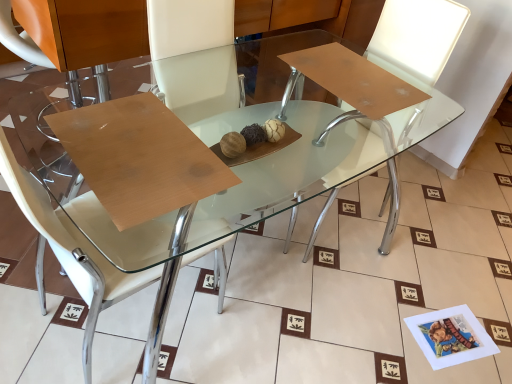
Measure the distance between white leather chair at center, the first chair in the left-to-right sequence, and camera.

They are 25.35 inches apart.

The image size is (512, 384). Identify the location of wooden at center. (139, 157).

Considering the relative positions of white leather chair at center, the first chair in the left-to-right sequence, and white leather chair at center, acting as the 2th chair starting from the left, in the image provided, is white leather chair at center, the first chair in the left-to-right sequence, in front of white leather chair at center, acting as the 2th chair starting from the left,?

Yes.

Which is more to the right, white leather chair at center, which is counted as the second chair, starting from the right, or white leather chair at center, which ranks as the first chair in right-to-left order?

From the viewer's perspective, white leather chair at center, which ranks as the first chair in right-to-left order, appears more on the right side.

Which object is thinner, white leather chair at center, the first chair in the left-to-right sequence, or white leather chair at center, which ranks as the first chair in right-to-left order?

white leather chair at center, the first chair in the left-to-right sequence.

Who is smaller, white leather chair at center, the first chair in the left-to-right sequence, or white leather chair at center, acting as the 2th chair starting from the left?

With smaller size is white leather chair at center, acting as the 2th chair starting from the left.

In order to click on cardboard on the right side of white leather chair at center, the first chair in the left-to-right sequence in this screenshot , I will do `click(139, 157)`.

Could you tell me if wooden at center is turned towards white leather chair at center, the first chair in the left-to-right sequence?

Yes, wooden at center is facing white leather chair at center, the first chair in the left-to-right sequence.

Which of these two, wooden at center or white leather chair at center, which is counted as the second chair, starting from the right, is smaller?

wooden at center.

Can you tell me how much wooden at center and white leather chair at center, the first chair in the left-to-right sequence, differ in facing direction?

The angular difference between wooden at center and white leather chair at center, the first chair in the left-to-right sequence, is 93.3 degrees.

At what (x,y) coordinates should I click in order to perform the action: click on cardboard behind the white leather chair at center, which is counted as the second chair, starting from the right. Please return your answer as a coordinate pair (x, y). Looking at the image, I should click on (139, 157).

Would you consider white leather chair at center, the first chair in the left-to-right sequence, to be distant from wooden at center?

Actually, white leather chair at center, the first chair in the left-to-right sequence, and wooden at center are a little close together.

Could you tell me if white leather chair at center, which is counted as the second chair, starting from the right, is facing wooden at center?

Yes, white leather chair at center, which is counted as the second chair, starting from the right, is facing wooden at center.

Looking at this image, which object is further away from the camera, white leather chair at center, which is counted as the second chair, starting from the right, or wooden at center?

wooden at center is further away from the camera.

Looking at the image, does white leather chair at center, acting as the 2th chair starting from the left, seem bigger or smaller compared to wooden at center?

Clearly, white leather chair at center, acting as the 2th chair starting from the left, is larger in size than wooden at center.

You are a GUI agent. You are given a task and a screenshot of the screen. Output one action in this format:
    pyautogui.click(x=<x>, y=<y>)
    Task: Click on the cardboard that is above the white leather chair at center, which ranks as the first chair in right-to-left order (from a real-world perspective)
    The image size is (512, 384).
    Given the screenshot: What is the action you would take?
    pyautogui.click(x=139, y=157)

Can wooden at center be found inside white leather chair at center, which ranks as the first chair in right-to-left order?

Definitely not — wooden at center is not inside white leather chair at center, which ranks as the first chair in right-to-left order.

Is wooden at center inside the boundaries of white leather chair at center, which ranks as the first chair in right-to-left order, or outside?

wooden at center is not enclosed by white leather chair at center, which ranks as the first chair in right-to-left order.

Locate an element on the screen. Image resolution: width=512 pixels, height=384 pixels. chair above the wooden at center (from the image's perspective) is located at coordinates (398, 96).

What's the angular difference between wooden at center and white leather chair at center, which ranks as the first chair in right-to-left order,'s facing directions?

The angular difference between wooden at center and white leather chair at center, which ranks as the first chair in right-to-left order, is 90 degrees.

Does point (84, 142) appear closer or farther from the camera than point (390, 191)?

Point (84, 142).

Does white leather chair at center, acting as the 2th chair starting from the left, turn towards white leather chair at center, which is counted as the second chair, starting from the right?

No, white leather chair at center, acting as the 2th chair starting from the left, does not turn towards white leather chair at center, which is counted as the second chair, starting from the right.

Find the location of a particular element. This screenshot has width=512, height=384. chair that is behind the white leather chair at center, which is counted as the second chair, starting from the right is located at coordinates (398, 96).

Is point (368, 147) closer or farther from the camera than point (49, 207)?

Point (368, 147) is farther from the camera than point (49, 207).

Image resolution: width=512 pixels, height=384 pixels. What are the coordinates of `chair below the white leather chair at center, which is counted as the second chair, starting from the right (from a real-world perspective)` in the screenshot? It's located at (398, 96).

Where is `chair that is below the wooden at center (from the image's perspective)`? chair that is below the wooden at center (from the image's perspective) is located at coordinates (72, 249).

Estimate the real-world distances between objects in this image. Which object is further from white leather chair at center, which is counted as the second chair, starting from the right, wooden at center or white leather chair at center, which ranks as the first chair in right-to-left order?

white leather chair at center, which ranks as the first chair in right-to-left order, is positioned further to the anchor white leather chair at center, which is counted as the second chair, starting from the right.

Estimate the real-world distances between objects in this image. Which object is closer to white leather chair at center, which ranks as the first chair in right-to-left order, white leather chair at center, which is counted as the second chair, starting from the right, or wooden at center?

Based on the image, wooden at center appears to be nearer to white leather chair at center, which ranks as the first chair in right-to-left order.

When comparing their distances from wooden at center, does white leather chair at center, acting as the 2th chair starting from the left, or white leather chair at center, the first chair in the left-to-right sequence, seem further?

The object further to wooden at center is white leather chair at center, acting as the 2th chair starting from the left.

Consider the image. Looking at the image, which one is located further to wooden at center, white leather chair at center, the first chair in the left-to-right sequence, or white leather chair at center, which ranks as the first chair in right-to-left order?

The object further to wooden at center is white leather chair at center, which ranks as the first chair in right-to-left order.

From the image, which object appears to be nearer to white leather chair at center, the first chair in the left-to-right sequence, white leather chair at center, which ranks as the first chair in right-to-left order, or wooden at center?

wooden at center is closer to white leather chair at center, the first chair in the left-to-right sequence.

From the image, which object appears to be nearer to white leather chair at center, acting as the 2th chair starting from the left, wooden at center or white leather chair at center, the first chair in the left-to-right sequence?

wooden at center lies closer to white leather chair at center, acting as the 2th chair starting from the left, than the other object.

Where is `cardboard between white leather chair at center, the first chair in the left-to-right sequence, and white leather chair at center, acting as the 2th chair starting from the left, from left to right`? cardboard between white leather chair at center, the first chair in the left-to-right sequence, and white leather chair at center, acting as the 2th chair starting from the left, from left to right is located at coordinates (139, 157).